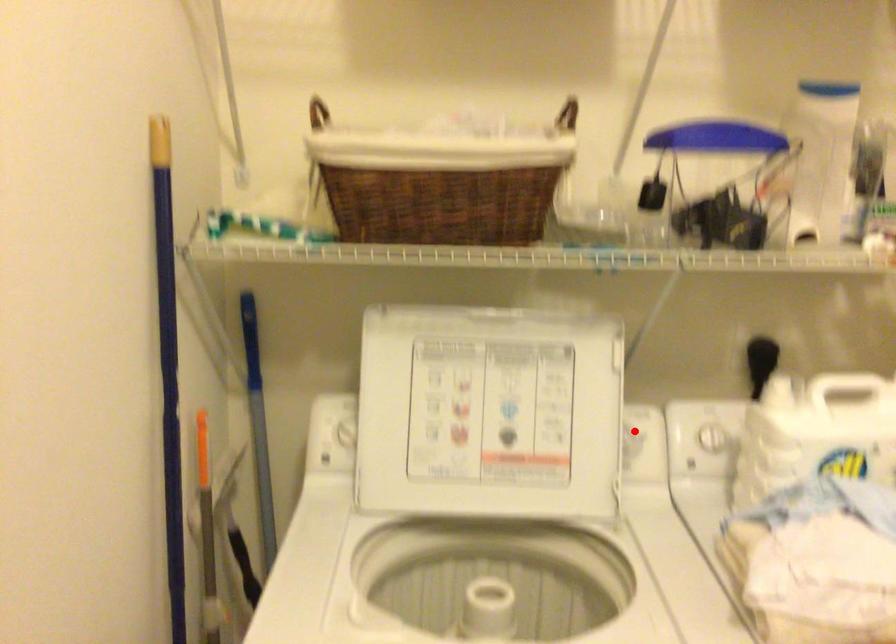
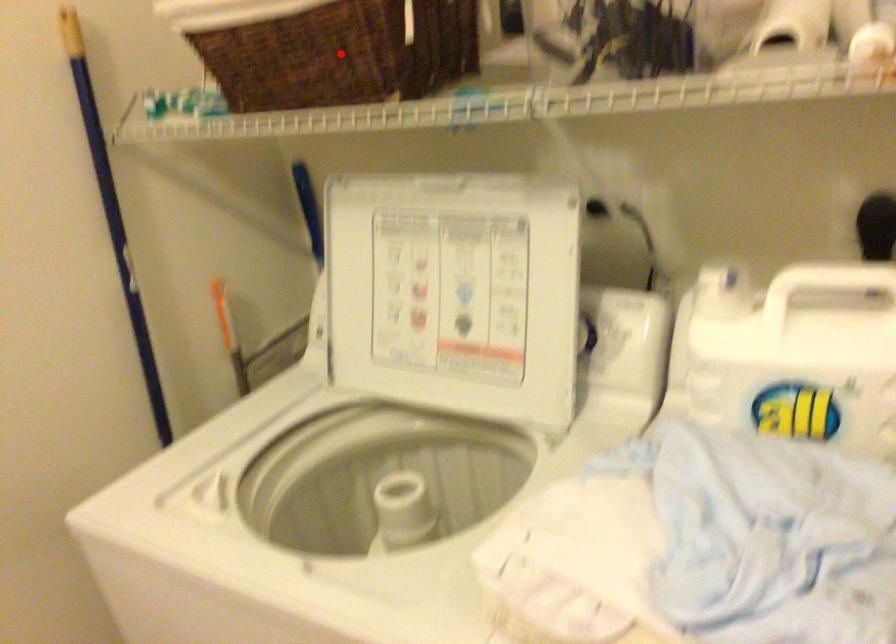
I am providing you with two images of the same scene from different viewpoints. A red point is marked on the first image and another point is marked on the second image. Is the red point in image1 aligned with the point shown in image2?

No